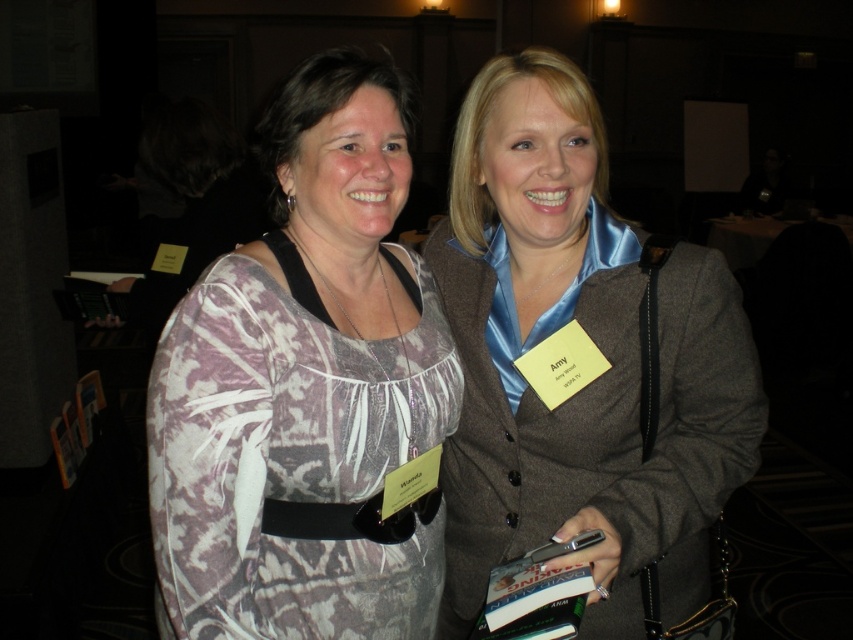
Question: Which point is closer to the camera?

Choices:
 (A) printed fabric dress at center
 (B) satin blue blouse at center

Answer: (B)

Question: Does printed fabric dress at center come in front of satin blue blouse at center?

Choices:
 (A) no
 (B) yes

Answer: (A)

Question: Is printed fabric dress at center below satin blue blouse at center?

Choices:
 (A) yes
 (B) no

Answer: (B)

Question: Among these objects, which one is farthest from the camera?

Choices:
 (A) printed fabric dress at center
 (B) satin blue blouse at center

Answer: (A)

Question: Can you confirm if printed fabric dress at center is positioned below satin blue blouse at center?

Choices:
 (A) no
 (B) yes

Answer: (A)